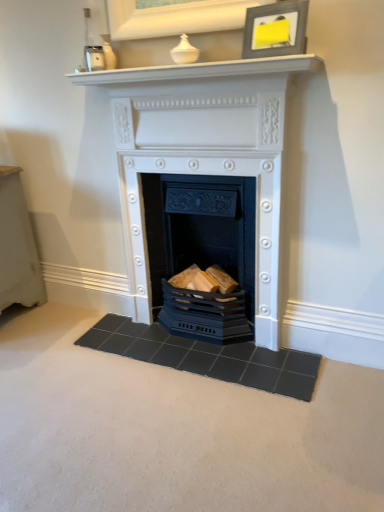
Measure the distance between white matte fireplace at center, the second fireplace ordered from the bottom, and camera.

The distance of white matte fireplace at center, the second fireplace ordered from the bottom, from camera is 1.49 meters.

What is the approximate width of matte black picture frame at upper center?

matte black picture frame at upper center is 2.62 inches wide.

Image resolution: width=384 pixels, height=512 pixels. In order to click on white glossy mantle at upper center in this screenshot , I will do `click(199, 71)`.

At what (x,y) coordinates should I click in order to perform the action: click on dark gray tile doormat at center. Please return your answer as a coordinate pair (x, y). Image resolution: width=384 pixels, height=512 pixels. Looking at the image, I should click on (207, 356).

Considering the relative sizes of dark gray tile doormat at center and matte black picture frame at upper center in the image provided, is dark gray tile doormat at center wider than matte black picture frame at upper center?

Yes.

Which is more to the left, dark gray tile doormat at center or matte black picture frame at upper center?

Positioned to the left is dark gray tile doormat at center.

Choose the correct answer: Is dark gray tile doormat at center inside matte black picture frame at upper center or outside it?

dark gray tile doormat at center is located beyond the bounds of matte black picture frame at upper center.

From the image's perspective, which one is positioned lower, matte black fireplace at center, the 2th fireplace from the top, or white matte fireplace at center, marked as the 1th fireplace in a top-to-bottom arrangement?

matte black fireplace at center, the 2th fireplace from the top, is shown below in the image.

Is matte black fireplace at center, placed as the 1th fireplace when sorted from bottom to top, in front of or behind white matte fireplace at center, the second fireplace ordered from the bottom, in the image?

matte black fireplace at center, placed as the 1th fireplace when sorted from bottom to top, is behind white matte fireplace at center, the second fireplace ordered from the bottom.

In the scene shown: From a real-world perspective, which object rests below the other?

From a 3D spatial view, matte black fireplace at center, placed as the 1th fireplace when sorted from bottom to top, is below.

Which is farther from the camera, (207, 232) or (239, 223)?

The point (207, 232) is behind.

From the image's perspective, is matte black fireplace at center, placed as the 1th fireplace when sorted from bottom to top, on top of matte black picture frame at upper center?

Incorrect, from the image's perspective, matte black fireplace at center, placed as the 1th fireplace when sorted from bottom to top, is lower than matte black picture frame at upper center.

Which is less distant, (189, 215) or (276, 25)?

The point (276, 25) is closer.

Who is shorter, matte black fireplace at center, placed as the 1th fireplace when sorted from bottom to top, or matte black picture frame at upper center?

matte black picture frame at upper center is shorter.

Is matte black fireplace at center, placed as the 1th fireplace when sorted from bottom to top, not within matte black picture frame at upper center?

matte black fireplace at center, placed as the 1th fireplace when sorted from bottom to top, is positioned outside matte black picture frame at upper center.

Does white glossy mantle at upper center turn towards dark gray tile doormat at center?

No, white glossy mantle at upper center is not turned towards dark gray tile doormat at center.

Is white glossy mantle at upper center located outside dark gray tile doormat at center?

Yes, white glossy mantle at upper center is located beyond the bounds of dark gray tile doormat at center.

From a real-world perspective, is white glossy mantle at upper center physically above dark gray tile doormat at center?

Indeed, from a real-world perspective, white glossy mantle at upper center stands above dark gray tile doormat at center.

Who is taller, white glossy mantle at upper center or matte black fireplace at center, the 2th fireplace from the top?

With more height is matte black fireplace at center, the 2th fireplace from the top.

Which point is more forward, (281, 69) or (185, 264)?

Positioned in front is point (281, 69).

Considering the sizes of white glossy mantle at upper center and matte black fireplace at center, the 2th fireplace from the top, in the image, is white glossy mantle at upper center wider or thinner than matte black fireplace at center, the 2th fireplace from the top,?

Considering their sizes, white glossy mantle at upper center looks slimmer than matte black fireplace at center, the 2th fireplace from the top.

Which is more to the left, white matte fireplace at center, marked as the 1th fireplace in a top-to-bottom arrangement, or matte black fireplace at center, the 2th fireplace from the top?

white matte fireplace at center, marked as the 1th fireplace in a top-to-bottom arrangement.

Considering the relative sizes of white matte fireplace at center, marked as the 1th fireplace in a top-to-bottom arrangement, and matte black fireplace at center, placed as the 1th fireplace when sorted from bottom to top, in the image provided, is white matte fireplace at center, marked as the 1th fireplace in a top-to-bottom arrangement, wider than matte black fireplace at center, placed as the 1th fireplace when sorted from bottom to top,?

No.

Does white matte fireplace at center, marked as the 1th fireplace in a top-to-bottom arrangement, touch matte black fireplace at center, placed as the 1th fireplace when sorted from bottom to top?

Yes, white matte fireplace at center, marked as the 1th fireplace in a top-to-bottom arrangement, is next to matte black fireplace at center, placed as the 1th fireplace when sorted from bottom to top.

Locate an element on the screen. Image resolution: width=384 pixels, height=512 pixels. picture frame in front of the white matte fireplace at center, the second fireplace ordered from the bottom is located at coordinates coord(276,29).

Between matte black picture frame at upper center and white matte fireplace at center, marked as the 1th fireplace in a top-to-bottom arrangement, which one appears on the left side from the viewer's perspective?

Positioned to the left is white matte fireplace at center, marked as the 1th fireplace in a top-to-bottom arrangement.

Is matte black picture frame at upper center far from white matte fireplace at center, marked as the 1th fireplace in a top-to-bottom arrangement?

No, matte black picture frame at upper center is not far away from white matte fireplace at center, marked as the 1th fireplace in a top-to-bottom arrangement.

From a real-world perspective, who is located higher, matte black picture frame at upper center or white matte fireplace at center, marked as the 1th fireplace in a top-to-bottom arrangement?

In real-world perspective, matte black picture frame at upper center is above.

This screenshot has height=512, width=384. What are the coordinates of `picture frame that is above the dark gray tile doormat at center (from a real-world perspective)` in the screenshot? It's located at (276, 29).

This screenshot has width=384, height=512. In order to click on fireplace on the left of matte black fireplace at center, placed as the 1th fireplace when sorted from bottom to top in this screenshot , I will do `click(205, 208)`.

Estimate the real-world distances between objects in this image. Which object is further from dark gray tile doormat at center, matte black picture frame at upper center or matte black fireplace at center, placed as the 1th fireplace when sorted from bottom to top?

matte black picture frame at upper center is positioned further to the anchor dark gray tile doormat at center.

When comparing their distances from matte black fireplace at center, placed as the 1th fireplace when sorted from bottom to top, does white glossy mantle at upper center or dark gray tile doormat at center seem closer?

dark gray tile doormat at center lies closer to matte black fireplace at center, placed as the 1th fireplace when sorted from bottom to top, than the other object.

Estimate the real-world distances between objects in this image. Which object is closer to dark gray tile doormat at center, matte black fireplace at center, placed as the 1th fireplace when sorted from bottom to top, or matte black picture frame at upper center?

matte black fireplace at center, placed as the 1th fireplace when sorted from bottom to top, is positioned closer to the anchor dark gray tile doormat at center.

When comparing their distances from white matte fireplace at center, marked as the 1th fireplace in a top-to-bottom arrangement, does white glossy mantle at upper center or matte black picture frame at upper center seem closer?

white glossy mantle at upper center is closer to white matte fireplace at center, marked as the 1th fireplace in a top-to-bottom arrangement.

Looking at the image, which one is located closer to white matte fireplace at center, marked as the 1th fireplace in a top-to-bottom arrangement, matte black fireplace at center, placed as the 1th fireplace when sorted from bottom to top, or matte black picture frame at upper center?

matte black fireplace at center, placed as the 1th fireplace when sorted from bottom to top, lies closer to white matte fireplace at center, marked as the 1th fireplace in a top-to-bottom arrangement, than the other object.

When comparing their distances from dark gray tile doormat at center, does white matte fireplace at center, the second fireplace ordered from the bottom, or white glossy mantle at upper center seem closer?

white matte fireplace at center, the second fireplace ordered from the bottom.

Estimate the real-world distances between objects in this image. Which object is closer to dark gray tile doormat at center, white glossy mantle at upper center or white matte fireplace at center, the second fireplace ordered from the bottom?

Based on the image, white matte fireplace at center, the second fireplace ordered from the bottom, appears to be nearer to dark gray tile doormat at center.

Which object lies nearer to the anchor point matte black picture frame at upper center, matte black fireplace at center, placed as the 1th fireplace when sorted from bottom to top, or dark gray tile doormat at center?

matte black fireplace at center, placed as the 1th fireplace when sorted from bottom to top, is closer to matte black picture frame at upper center.

At what (x,y) coordinates should I click in order to perform the action: click on mantle that lies between matte black picture frame at upper center and dark gray tile doormat at center from top to bottom. Please return your answer as a coordinate pair (x, y). Image resolution: width=384 pixels, height=512 pixels. Looking at the image, I should click on (199, 71).

Locate an element on the screen. fireplace that lies between white matte fireplace at center, the second fireplace ordered from the bottom, and dark gray tile doormat at center from top to bottom is located at coordinates (201, 231).

The image size is (384, 512). I want to click on mantle between matte black picture frame at upper center and white matte fireplace at center, the second fireplace ordered from the bottom, from top to bottom, so click(x=199, y=71).

At what (x,y) coordinates should I click in order to perform the action: click on fireplace between white glossy mantle at upper center and matte black fireplace at center, the 2th fireplace from the top, from top to bottom. Please return your answer as a coordinate pair (x, y). This screenshot has width=384, height=512. Looking at the image, I should click on (205, 208).